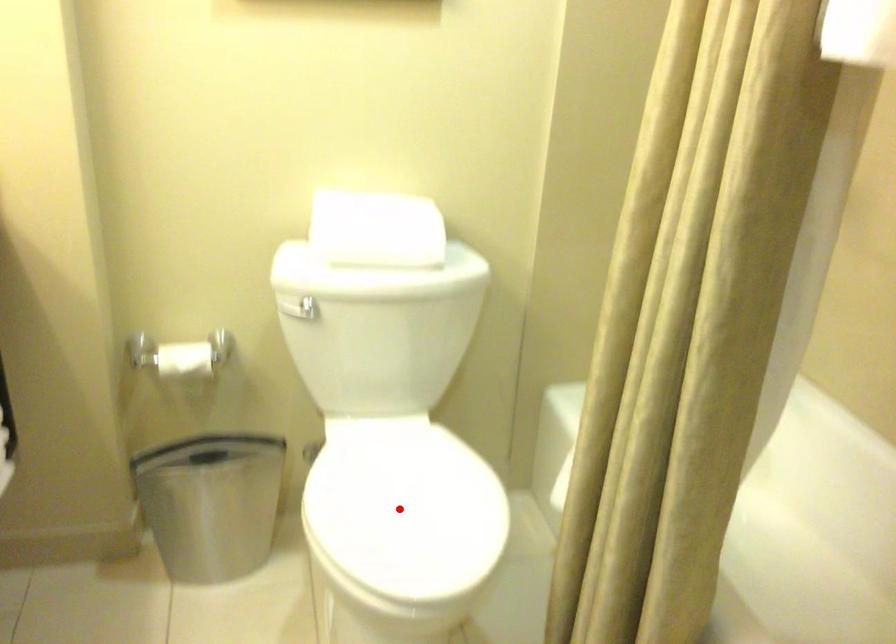
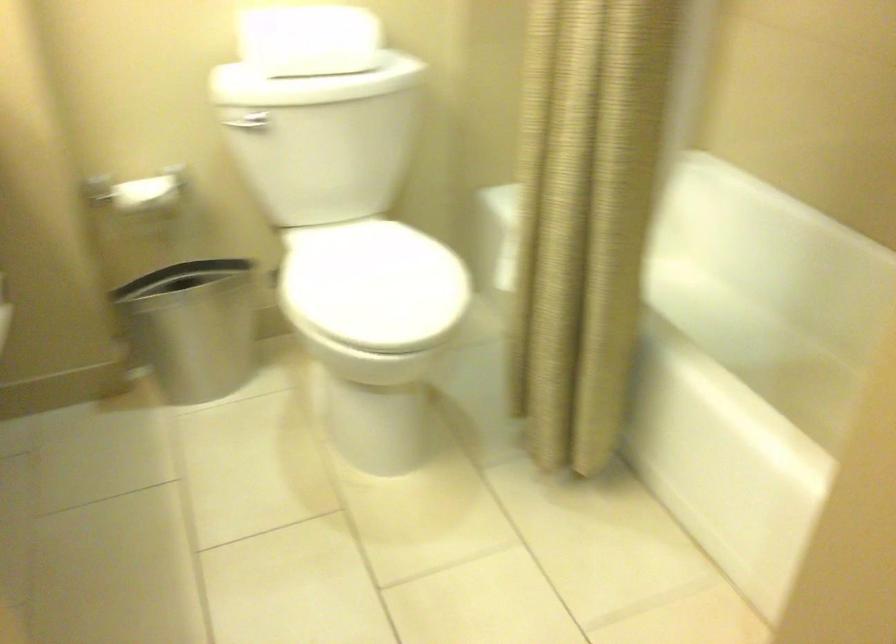
Question: I am providing you with two images of the same scene from different viewpoints. In image1, a red point is highlighted. Considering the same 3D point in image2, which of the following is correct?

Choices:
 (A) It is closer
 (B) It is farther

Answer: (B)